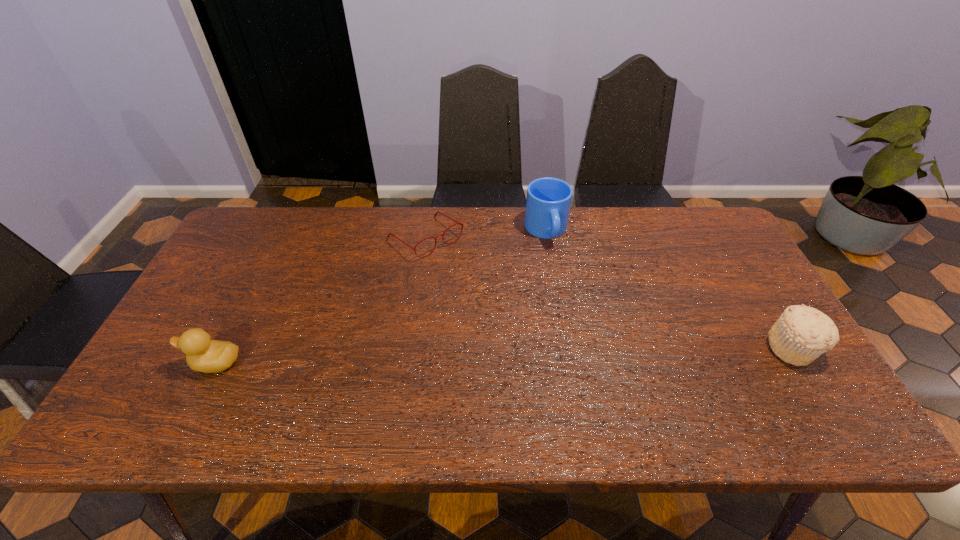
The width and height of the screenshot is (960, 540). Identify the location of vacant area located 0.130m on the face of the second object from left to right. (476, 280).

The height and width of the screenshot is (540, 960). Find the location of `free space located 0.170m on the side of the second object from right to left with the handle`. free space located 0.170m on the side of the second object from right to left with the handle is located at coordinates (567, 289).

In order to click on free space located 0.290m on the side of the second object from right to left with the handle in this screenshot , I will do `click(580, 322)`.

Locate an element on the screen. free space located 0.150m on the side of the second object from right to left with the handle is located at coordinates (565, 284).

The image size is (960, 540). In order to click on spectacles that is at the far edge in this screenshot , I will do `click(457, 222)`.

Find the location of a particular element. mug at the far edge is located at coordinates (548, 201).

Where is `duckling located at the near edge`? duckling located at the near edge is located at coordinates point(205,355).

Image resolution: width=960 pixels, height=540 pixels. I want to click on muffin positioned at the near edge, so click(802, 333).

Identify the location of object located in the left edge section of the desktop. This screenshot has height=540, width=960. pos(205,355).

Locate an element on the screen. This screenshot has width=960, height=540. object present at the right edge is located at coordinates (802, 333).